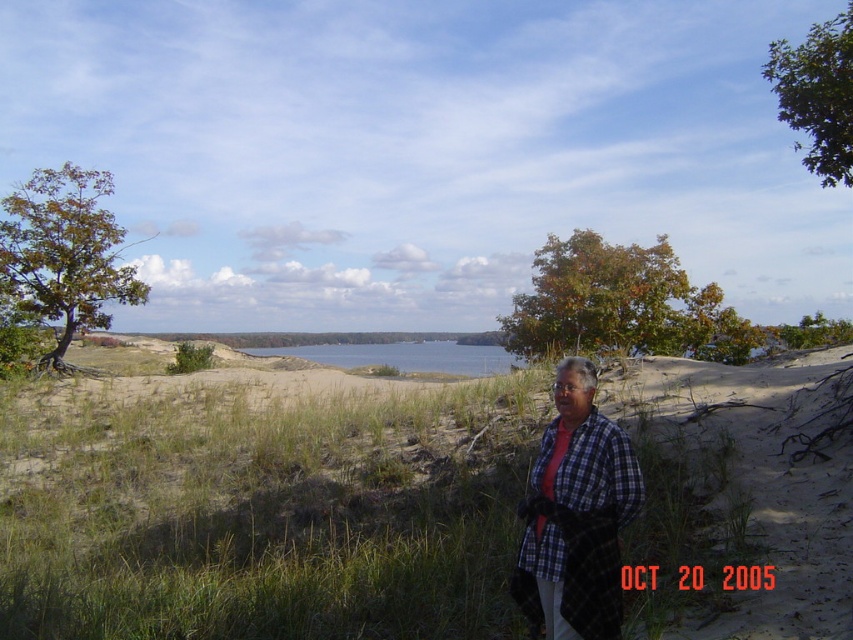
You are a photographer trying to capture the blue water at center and the green leafy tree at upper left in the same frame. Based on their positions, which object would appear closer to the left edge of your photo?

The green leafy tree at upper left would appear closer to the left edge of the photo since it is positioned on the left side of the blue water at center.

Based on the scene described, which object, the green leafy tree at upper center or the blue water at center, is taller?

The green leafy tree at upper center is taller than the blue water at center according to the description.

Based on the scene described, which object occupies a greater area in the image? Please consider the green leafy tree at upper left and the blue water at center in your answer.

The green leafy tree at upper left occupies a greater area in the image compared to the blue water at center, as it is described as larger in size.